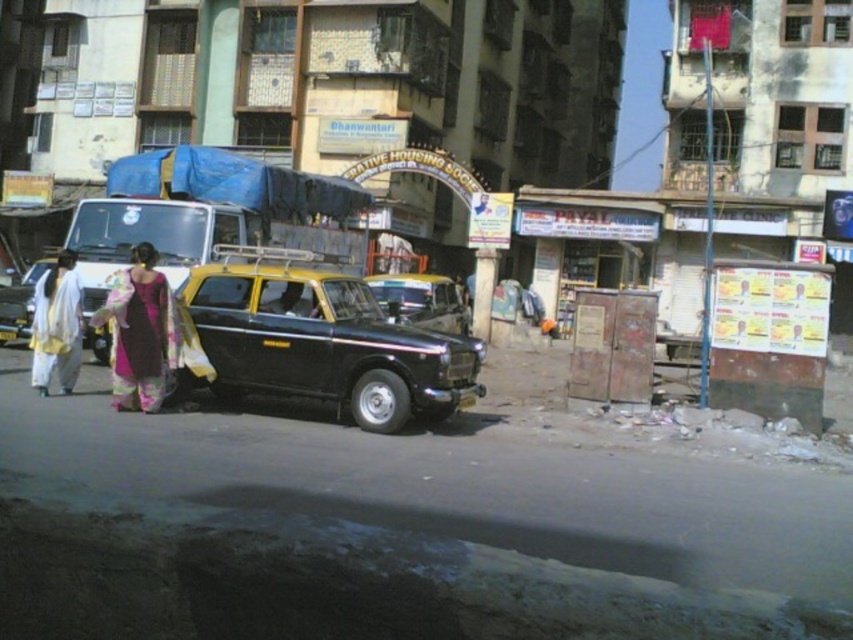
From the picture: You are a pedestrian standing in front of the black matte taxi at center and the yellow matte taxi at center. Which taxi is closer to you?

The black matte taxi at center is closer to you than the yellow matte taxi at center.

You are standing at the point marked by the coordinates point (56, 324) in the image. Looking around, you see a black and yellow taxi parked nearby and two people walking away from you. Which direction should you move to reach the white cotton saree at left?

The point (56, 324) is located on the white cotton saree at left, so you are already at the saree.

You are a delivery person needing to choose between two taxis for a short trip. The black matte taxi at center and the yellow matte taxi at center are available. Which one would you choose if you prefer a larger vehicle?

The black matte taxi at center is larger than the yellow matte taxi at center, so you should choose the black matte taxi at center.